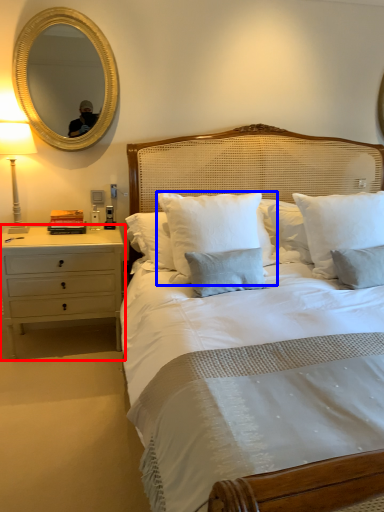
Question: Among these objects, which one is farthest to the camera, nightstand (highlighted by a red box) or pillow (highlighted by a blue box)?

Choices:
 (A) nightstand
 (B) pillow

Answer: (A)